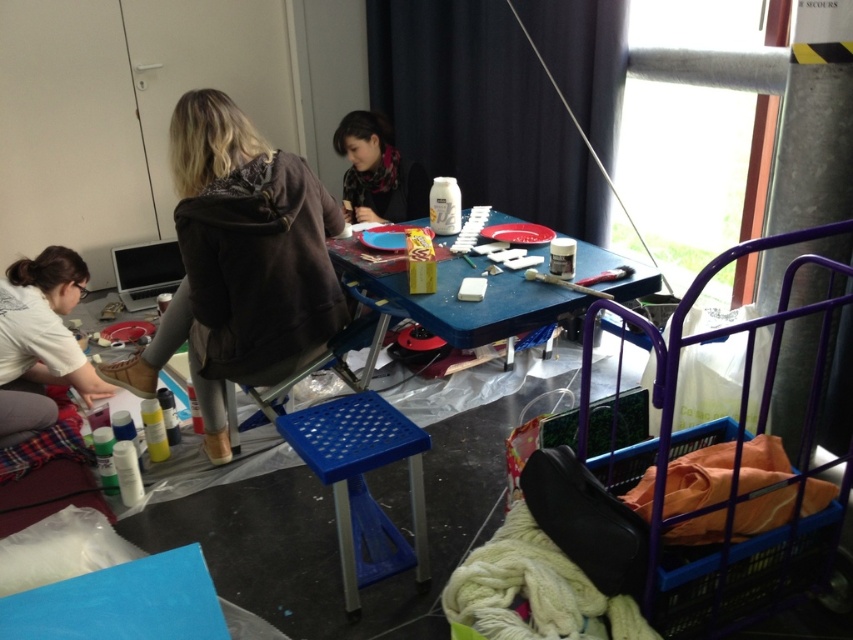
Question: Among these objects, which one is farthest from the camera?

Choices:
 (A) blue plastic chair at center
 (B) blue plastic stool at center

Answer: (A)

Question: Is brown suede jacket at upper left to the left of blue plastic chair at center from the viewer's perspective?

Choices:
 (A) no
 (B) yes

Answer: (B)

Question: Among these points, which one is farthest from the camera?

Choices:
 (A) (341, 323)
 (B) (64, 353)

Answer: (B)

Question: Is blue plastic table at center to the right of white matte shirt at lower left from the viewer's perspective?

Choices:
 (A) no
 (B) yes

Answer: (B)

Question: Which object is closer to the camera taking this photo?

Choices:
 (A) blue plastic table at center
 (B) blue plastic chair at center

Answer: (A)

Question: Can you confirm if brown suede jacket at upper left is positioned to the left of blue plastic chair at center?

Choices:
 (A) no
 (B) yes

Answer: (B)